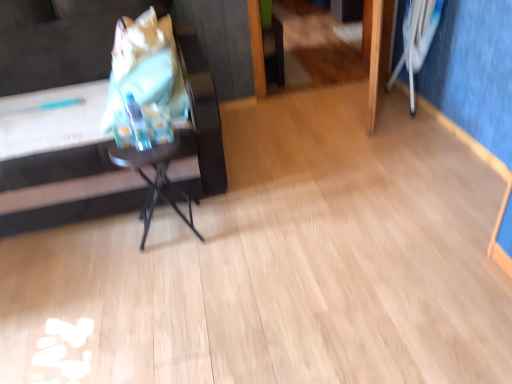
Question: Is matte black side table at left inside or outside of white fabric swivel chair at upper right?

Choices:
 (A) outside
 (B) inside

Answer: (A)

Question: In terms of height, does matte black side table at left look taller or shorter compared to white fabric swivel chair at upper right?

Choices:
 (A) tall
 (B) short

Answer: (A)

Question: Which object is positioned farthest from the white fabric swivel chair at upper right?

Choices:
 (A) metallic black table at center
 (B) matte black side table at left
 (C) matte plastic grocery bag at left

Answer: (B)

Question: Considering the real-world distances, which object is farthest from the white fabric swivel chair at upper right?

Choices:
 (A) matte plastic grocery bag at left
 (B) metallic black table at center
 (C) matte black side table at left

Answer: (C)